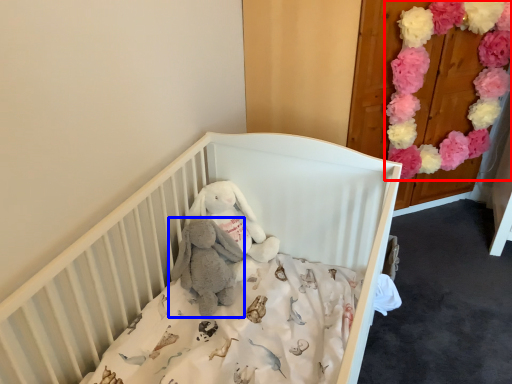
Question: Which of the following is the closest to the observer, flower (highlighted by a red box) or baby elephant (highlighted by a blue box)?

Choices:
 (A) flower
 (B) baby elephant

Answer: (B)